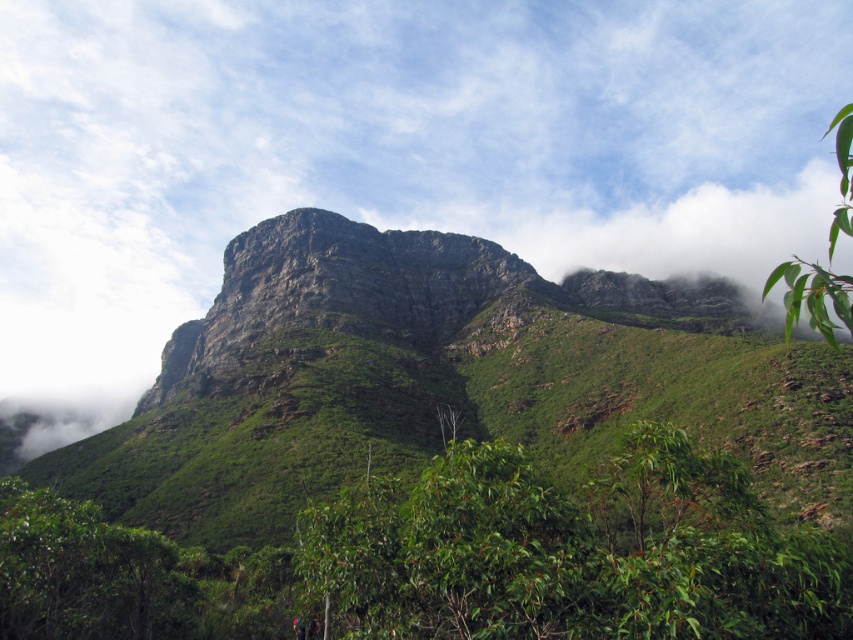
How distant is white fluffy cloud at upper center from green rocky mountain at center?

white fluffy cloud at upper center and green rocky mountain at center are 363.04 feet apart.

Is point (57, 362) positioned after point (850, 424)?

Yes, point (57, 362) is farther from viewer.

This screenshot has width=853, height=640. What do you see at coordinates (386, 152) in the screenshot? I see `white fluffy cloud at upper center` at bounding box center [386, 152].

Identify the location of white fluffy cloud at upper center. The image size is (853, 640). (386, 152).

Who is lower down, green leafy shrubs at center or green leafy branch at upper right?

green leafy shrubs at center is below.

Between green leafy shrubs at center and green leafy branch at upper right, which one appears on the right side from the viewer's perspective?

Positioned to the right is green leafy branch at upper right.

Identify the location of green leafy shrubs at center. (450, 557).

Can you confirm if white fluffy cloud at upper center is positioned below green leafy branch at upper right?

No.

Can you confirm if white fluffy cloud at upper center is positioned above green leafy branch at upper right?

Indeed, white fluffy cloud at upper center is positioned over green leafy branch at upper right.

Which is behind, point (288, 22) or point (839, 304)?

The point (288, 22) is more distant.

Identify the location of white fluffy cloud at upper center. (386, 152).